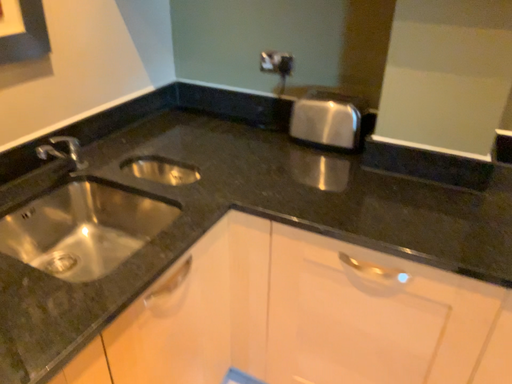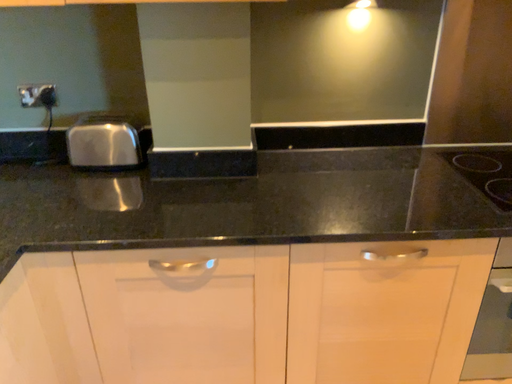
Question: How did the camera likely rotate when shooting the video?

Choices:
 (A) rotated right
 (B) rotated left

Answer: (A)